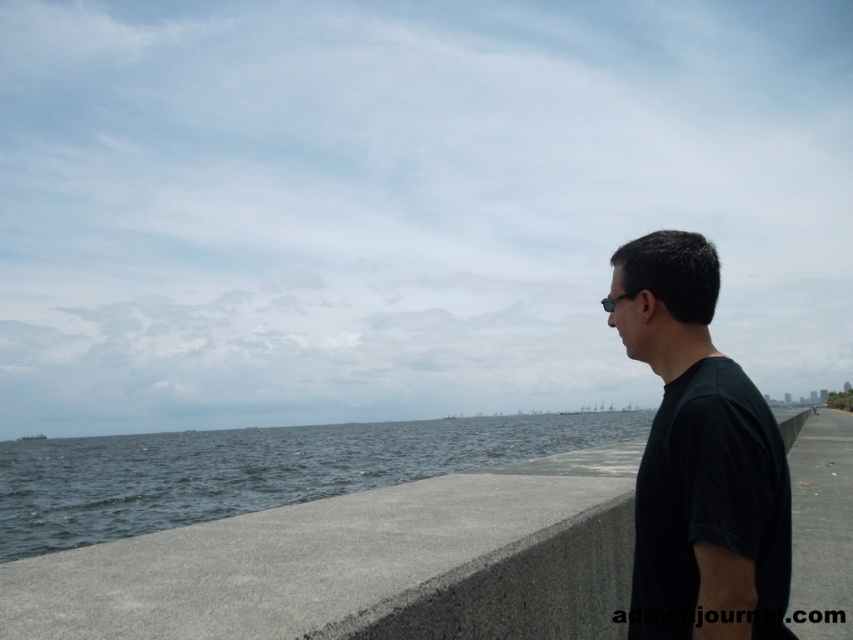
Question: Does gray concrete ledge at center lie behind black matte shirt at right?

Choices:
 (A) yes
 (B) no

Answer: (A)

Question: Does gray concrete ledge at center lie in front of black matte shirt at right?

Choices:
 (A) yes
 (B) no

Answer: (B)

Question: Among these points, which one is nearest to the camera?

Choices:
 (A) (675, 269)
 (B) (329, 554)

Answer: (A)

Question: Is gray concrete ledge at center above black matte shirt at right?

Choices:
 (A) no
 (B) yes

Answer: (A)